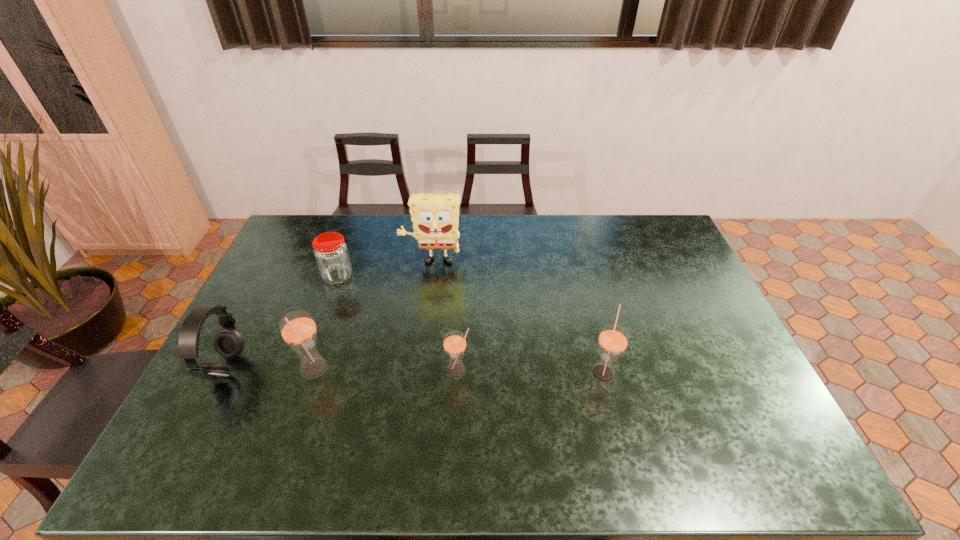
Find the location of a particular element. The height and width of the screenshot is (540, 960). vacant space in between the second shortest straw and the second straw from left to right is located at coordinates tap(530, 372).

The image size is (960, 540). I want to click on vacant space in between the sponge and the rightmost straw, so click(x=517, y=318).

Locate an element on the screen. vacant area that lies between the second shortest straw and the jar is located at coordinates (470, 325).

At what (x,y) coordinates should I click in order to perform the action: click on vacant point located between the shortest object and the leftmost straw. Please return your answer as a coordinate pair (x, y). Looking at the image, I should click on (325, 323).

Locate an element on the screen. Image resolution: width=960 pixels, height=540 pixels. blank region between the leftmost object and the sponge is located at coordinates (329, 315).

This screenshot has height=540, width=960. What are the coordinates of `blank region between the second straw from left to right and the sponge` in the screenshot? It's located at (444, 317).

Identify the location of free spot between the sponge and the second shortest straw. This screenshot has width=960, height=540. (517, 318).

This screenshot has width=960, height=540. I want to click on free space that is in between the second shortest straw and the earphone, so (415, 370).

Point out which object is positioned as the fourth nearest to the shortest object. Please provide its 2D coordinates. Your answer should be formatted as a tuple, i.e. [(x, y)], where the tuple contains the x and y coordinates of a point satisfying the conditions above.

[(454, 343)]

Choose which object is the fifth nearest neighbor to the jar. Please provide its 2D coordinates. Your answer should be formatted as a tuple, i.e. [(x, y)], where the tuple contains the x and y coordinates of a point satisfying the conditions above.

[(613, 339)]